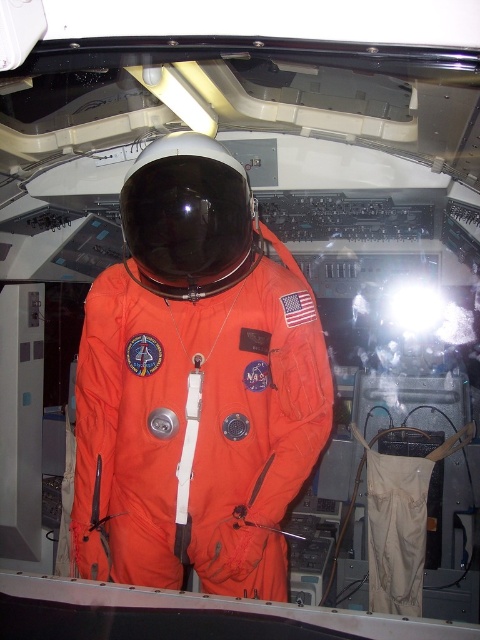
You are an engineer inspecting the cockpit of a spacecraft. You notice the orange fabric astronaut at center and the black matte helmet at center. Which object occupies more horizontal space in the cockpit?

The orange fabric astronaut at center is wider than the black matte helmet at center, so it occupies more horizontal space in the cockpit.

You are an astronaut inside the spacecraft cockpit. You need to reach both the point at coordinates point [117,470] and point [210,278]. Which point is closer to you?

Point [117,470] is closer to you because it is further to the viewer than point [210,278].